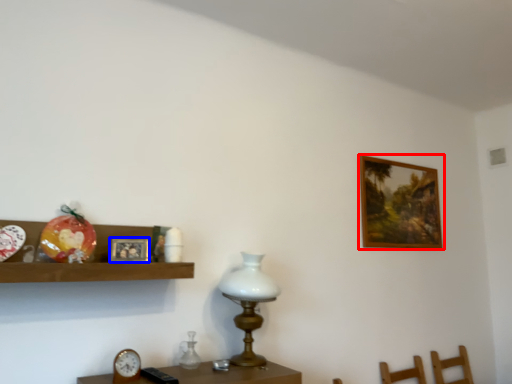
Question: Which object is further to the camera taking this photo, picture frame (highlighted by a red box) or picture frame (highlighted by a blue box)?

Choices:
 (A) picture frame
 (B) picture frame

Answer: (A)